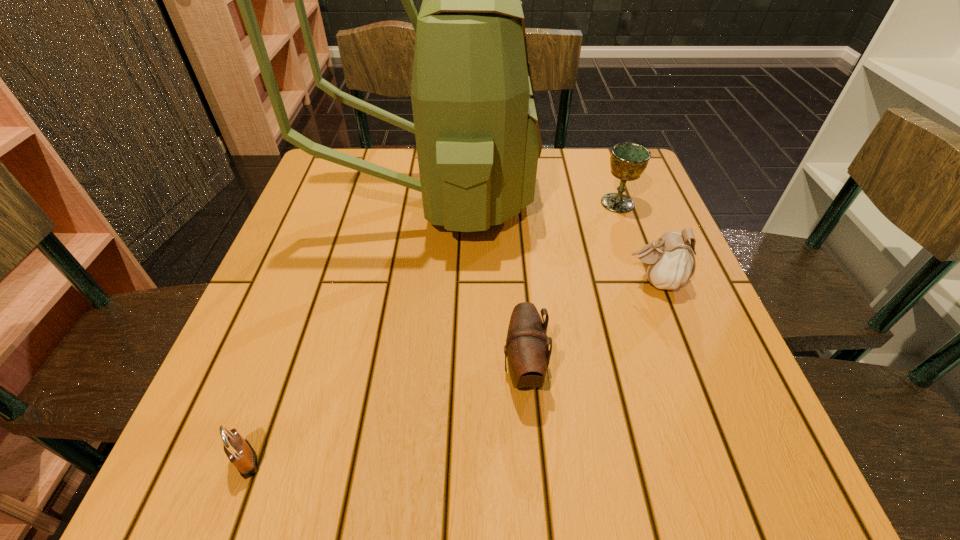
Where is `vacant space that's between the chalice and the right pouch`? The height and width of the screenshot is (540, 960). vacant space that's between the chalice and the right pouch is located at coordinates (636, 242).

Identify the location of free space between the nearer pouch and the nearest object. (385, 415).

Identify the location of vacant space that's between the left pouch and the chalice. (570, 286).

The width and height of the screenshot is (960, 540). I want to click on free space between the fourth farthest object and the backpack, so click(477, 284).

Where is `object that is the nearest to the chalice`? The image size is (960, 540). object that is the nearest to the chalice is located at coordinates (476, 125).

Find the location of a particular element. Image resolution: width=960 pixels, height=540 pixels. the closest object to the chalice is located at coordinates (476, 125).

This screenshot has width=960, height=540. In order to click on free space that satisfies the following two spatial constraints: 1. on the front pocket of the backpack; 2. on the right side of the chalice in this screenshot , I will do `click(430, 203)`.

The width and height of the screenshot is (960, 540). In order to click on free space that satisfies the following two spatial constraints: 1. on the front pocket of the backpack; 2. on the back side of the chalice in this screenshot , I will do `click(430, 203)`.